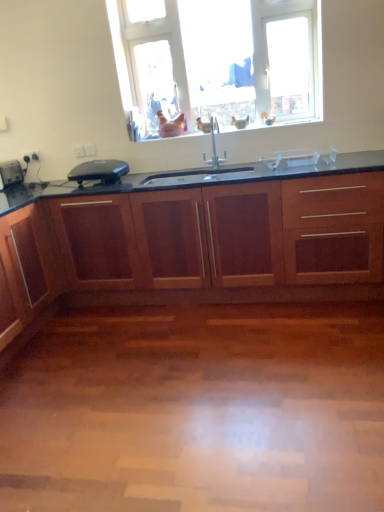
Question: Is satin nickel faucet at center closer to the viewer compared to clear plastic container at center, which is the 1th appliance in right-to-left order?

Choices:
 (A) no
 (B) yes

Answer: (A)

Question: Can you confirm if satin nickel faucet at center is smaller than clear plastic container at center, the third appliance in the left-to-right sequence?

Choices:
 (A) yes
 (B) no

Answer: (B)

Question: Does satin nickel faucet at center have a larger size compared to clear plastic container at center, which is the 1th appliance in right-to-left order?

Choices:
 (A) no
 (B) yes

Answer: (B)

Question: From a real-world perspective, is satin nickel faucet at center physically above clear plastic container at center, which is the 1th appliance in right-to-left order?

Choices:
 (A) no
 (B) yes

Answer: (B)

Question: Could you tell me if satin nickel faucet at center is turned towards clear plastic container at center, which is the 1th appliance in right-to-left order?

Choices:
 (A) no
 (B) yes

Answer: (A)

Question: From a real-world perspective, is transparent glass window at upper center physically located above or below mahogany wood cabinetry at center?

Choices:
 (A) above
 (B) below

Answer: (A)

Question: Is point (299, 35) closer or farther from the camera than point (284, 229)?

Choices:
 (A) closer
 (B) farther

Answer: (B)

Question: Relative to mahogany wood cabinetry at center, is transparent glass window at upper center in front or behind?

Choices:
 (A) behind
 (B) front

Answer: (A)

Question: From the image's perspective, is transparent glass window at upper center positioned above or below mahogany wood cabinetry at center?

Choices:
 (A) above
 (B) below

Answer: (A)

Question: From the image's perspective, is satin nickel faucet at center above or below transparent glass window at upper center?

Choices:
 (A) above
 (B) below

Answer: (B)

Question: Considering the positions of point (203, 160) and point (258, 64), is point (203, 160) closer or farther from the camera than point (258, 64)?

Choices:
 (A) closer
 (B) farther

Answer: (B)

Question: Based on their positions, is satin nickel faucet at center located to the left or right of transparent glass window at upper center?

Choices:
 (A) right
 (B) left

Answer: (B)

Question: From a real-world perspective, is satin nickel faucet at center above or below transparent glass window at upper center?

Choices:
 (A) above
 (B) below

Answer: (B)

Question: Visually, is black plastic toaster at left, the second appliance when ordered from left to right, positioned to the left or to the right of mahogany wood cabinetry at center?

Choices:
 (A) left
 (B) right

Answer: (A)

Question: From their relative heights in the image, would you say black plastic toaster at left, the second appliance when ordered from left to right, is taller or shorter than mahogany wood cabinetry at center?

Choices:
 (A) tall
 (B) short

Answer: (B)